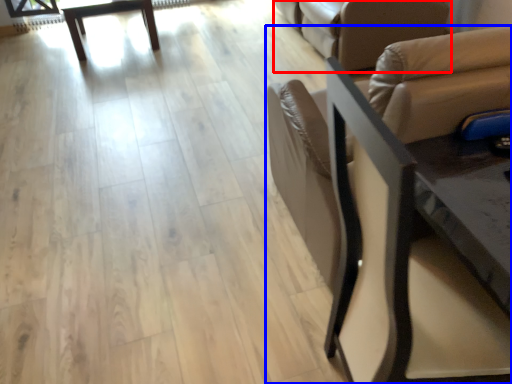
Question: Which point is closer to the camera, futon (highlighted by a red box) or chair (highlighted by a blue box)?

Choices:
 (A) futon
 (B) chair

Answer: (B)